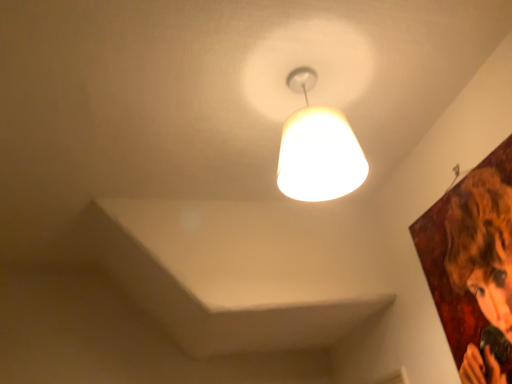
What is the approximate width of smooth brown hair at upper right?

1.07 inches.

Identify the location of smooth brown hair at upper right. (482, 244).

The image size is (512, 384). Describe the element at coordinates (482, 244) in the screenshot. I see `smooth brown hair at upper right` at that location.

Describe the element at coordinates (318, 149) in the screenshot. The height and width of the screenshot is (384, 512). I see `matte white lampshade at upper center` at that location.

This screenshot has width=512, height=384. What are the coordinates of `matte white lampshade at upper center` in the screenshot? It's located at (318, 149).

Measure the distance between matte white lampshade at upper center and camera.

The depth of matte white lampshade at upper center is 3.37 feet.

This screenshot has height=384, width=512. Find the location of `smooth brown hair at upper right`. smooth brown hair at upper right is located at coordinates (482, 244).

Considering the relative positions of matte white lampshade at upper center and smooth brown hair at upper right in the image provided, is matte white lampshade at upper center to the left of smooth brown hair at upper right from the viewer's perspective?

Indeed, matte white lampshade at upper center is positioned on the left side of smooth brown hair at upper right.

Which is in front, matte white lampshade at upper center or smooth brown hair at upper right?

smooth brown hair at upper right.

Which point is more forward, (283, 165) or (503, 284)?

Positioned in front is point (503, 284).

From the image's perspective, does matte white lampshade at upper center appear lower than smooth brown hair at upper right?

No, from the image's perspective, matte white lampshade at upper center is not beneath smooth brown hair at upper right.

From a real-world perspective, which is physically above, matte white lampshade at upper center or smooth brown hair at upper right?

In real-world perspective, matte white lampshade at upper center is above.

Looking at their sizes, would you say matte white lampshade at upper center is wider or thinner than smooth brown hair at upper right?

Clearly, matte white lampshade at upper center has more width compared to smooth brown hair at upper right.

From their relative heights in the image, would you say matte white lampshade at upper center is taller or shorter than smooth brown hair at upper right?

In the image, matte white lampshade at upper center appears to be shorter than smooth brown hair at upper right.

Is matte white lampshade at upper center smaller than smooth brown hair at upper right?

No, matte white lampshade at upper center is not smaller than smooth brown hair at upper right.

Could smooth brown hair at upper right be considered to be inside matte white lampshade at upper center?

No, smooth brown hair at upper right is not surrounded by matte white lampshade at upper center.

Is matte white lampshade at upper center in contact with smooth brown hair at upper right?

matte white lampshade at upper center and smooth brown hair at upper right are not in contact.

Does matte white lampshade at upper center turn towards smooth brown hair at upper right?

No.

What's the angular difference between matte white lampshade at upper center and smooth brown hair at upper right's facing directions?

The angle between the facing direction of matte white lampshade at upper center and the facing direction of smooth brown hair at upper right is 90.4 degrees.

Identify the location of person below the matte white lampshade at upper center (from the image's perspective). (482, 244).

Is smooth brown hair at upper right at the right side of matte white lampshade at upper center?

Yes.

Based on the photo, which object is closer to the camera, smooth brown hair at upper right or matte white lampshade at upper center?

smooth brown hair at upper right.

Is point (487, 253) positioned before point (284, 160)?

No, it is not.

From the image's perspective, which one is positioned higher, smooth brown hair at upper right or matte white lampshade at upper center?

matte white lampshade at upper center.

From a real-world perspective, who is located higher, smooth brown hair at upper right or matte white lampshade at upper center?

From a 3D spatial view, matte white lampshade at upper center is above.

Considering the sizes of objects smooth brown hair at upper right and matte white lampshade at upper center in the image provided, who is thinner, smooth brown hair at upper right or matte white lampshade at upper center?

With smaller width is smooth brown hair at upper right.

Who is taller, smooth brown hair at upper right or matte white lampshade at upper center?

smooth brown hair at upper right is taller.

Considering the sizes of objects smooth brown hair at upper right and matte white lampshade at upper center in the image provided, who is smaller, smooth brown hair at upper right or matte white lampshade at upper center?

smooth brown hair at upper right.

Is smooth brown hair at upper right spatially inside matte white lampshade at upper center, or outside of it?

smooth brown hair at upper right is not inside matte white lampshade at upper center, it's outside.

Is smooth brown hair at upper right in contact with matte white lampshade at upper center?

smooth brown hair at upper right is not next to matte white lampshade at upper center, and they're not touching.

Is smooth brown hair at upper right facing away from matte white lampshade at upper center?

No, smooth brown hair at upper right's orientation is not away from matte white lampshade at upper center.

Locate an element on the screen. This screenshot has height=384, width=512. lamp that appears behind the smooth brown hair at upper right is located at coordinates (318, 149).

In the image, there is a matte white lampshade at upper center. Where is `person below it (from the image's perspective)`? Image resolution: width=512 pixels, height=384 pixels. person below it (from the image's perspective) is located at coordinates (482, 244).

Where is `lamp on the left side of smooth brown hair at upper right`? lamp on the left side of smooth brown hair at upper right is located at coordinates (318, 149).